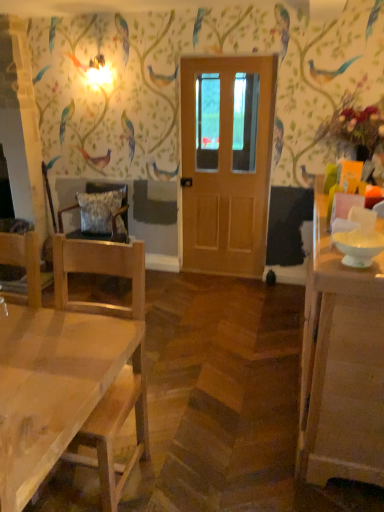
Question: Would you say natural wood chair at left, arranged as the 1th chair when viewed from the front, is inside or outside wooden chair with cushion at left, placed as the first chair when sorted from back to front?

Choices:
 (A) inside
 (B) outside

Answer: (B)

Question: In the image, is natural wood chair at left, acting as the 2th chair starting from the back, on the left side or the right side of wooden chair with cushion at left, the second chair when ordered from front to back?

Choices:
 (A) left
 (B) right

Answer: (B)

Question: Estimate the real-world distances between objects in this image. Which object is closer to the white glossy cabinet at right?

Choices:
 (A) fluffy fabric pillow at left
 (B) natural wood chair at left, acting as the 2th chair starting from the back
 (C) wooden door at center
 (D) wooden chair with cushion at left, the second chair when ordered from front to back

Answer: (B)

Question: Based on their relative distances, which object is farther from the wooden door at center?

Choices:
 (A) natural wood chair at left, acting as the 2th chair starting from the back
 (B) fluffy fabric pillow at left
 (C) white glossy cabinet at right
 (D) wooden chair with cushion at left, the second chair when ordered from front to back

Answer: (A)